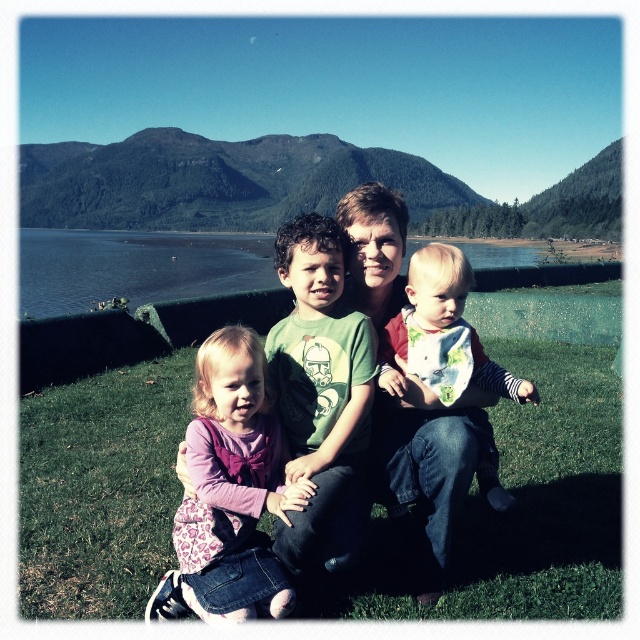
You are a photographer standing at the edge of the grassy area. You want to take a photo of the family so that both the green grass at center and the white cotton shirt at center are clearly visible. Which object should be closer to the camera to ensure both are in focus?

The green grass at center is shorter than the white cotton shirt at center. To ensure both are in focus, the photographer should position the white cotton shirt at center closer to the camera since it is taller than the green grass at center.

You are standing in front of the family photo. There are two points marked on the image, one at coordinates point (600,440) and the other at point (413,268). Which point is closer to you?

Point (600,440) is closer to you because it is further to the viewer than point (413,268).